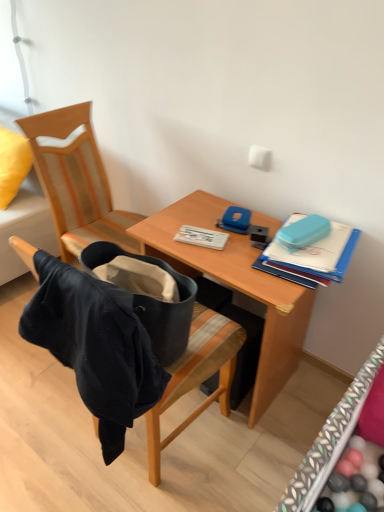
Find the location of `vacant space to the right of velvet black bag at center, the first chair viewed from the front`. vacant space to the right of velvet black bag at center, the first chair viewed from the front is located at coordinates (255, 453).